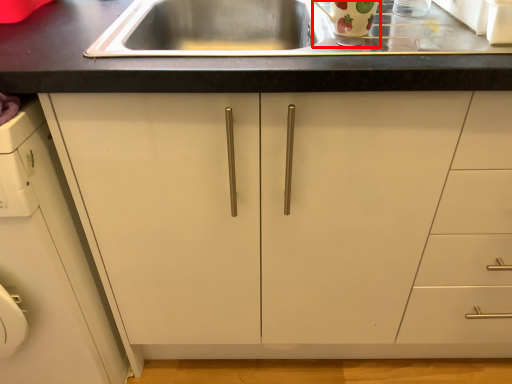
Question: From the image's perspective, considering the relative positions of appliance (annotated by the red box) and cabinetry in the image provided, where is appliance (annotated by the red box) located with respect to the staircase?

Choices:
 (A) below
 (B) above

Answer: (B)